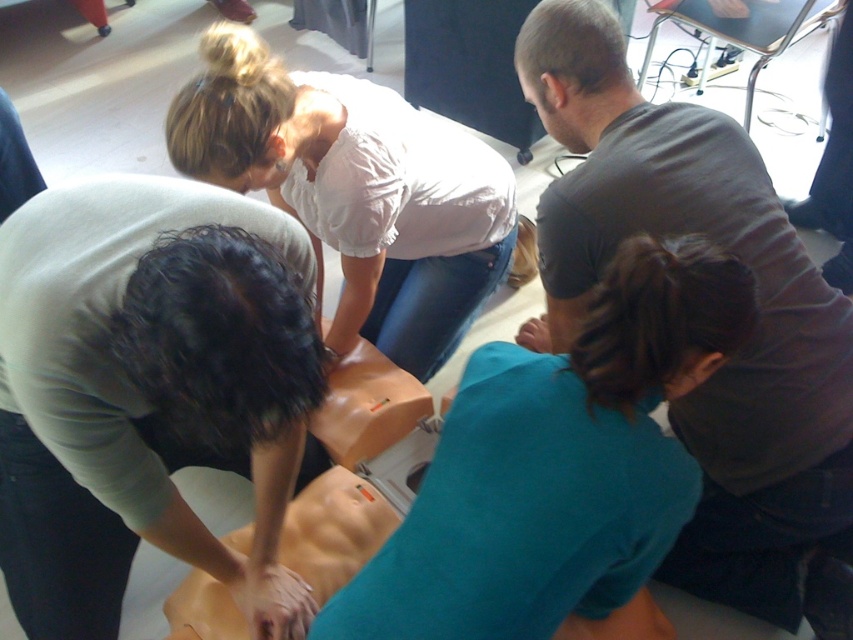
Question: Which point is closer to the camera taking this photo?

Choices:
 (A) (337, 124)
 (B) (611, 246)
 (C) (296, 312)

Answer: (C)

Question: Which of the following is the farthest from the observer?

Choices:
 (A) (91, 474)
 (B) (722, 554)

Answer: (B)

Question: Can you confirm if dark gray t-shirt at center is positioned above white cotton shirt at upper center?

Choices:
 (A) yes
 (B) no

Answer: (B)

Question: Based on their relative distances, which object is nearer to the dark gray t-shirt at center?

Choices:
 (A) matte green shirt at center
 (B) white cotton shirt at upper center
 (C) teal matte shirt at center

Answer: (C)

Question: Does matte green shirt at center have a lesser width compared to teal matte shirt at center?

Choices:
 (A) no
 (B) yes

Answer: (A)

Question: Is teal matte shirt at center positioned in front of white cotton shirt at upper center?

Choices:
 (A) yes
 (B) no

Answer: (A)